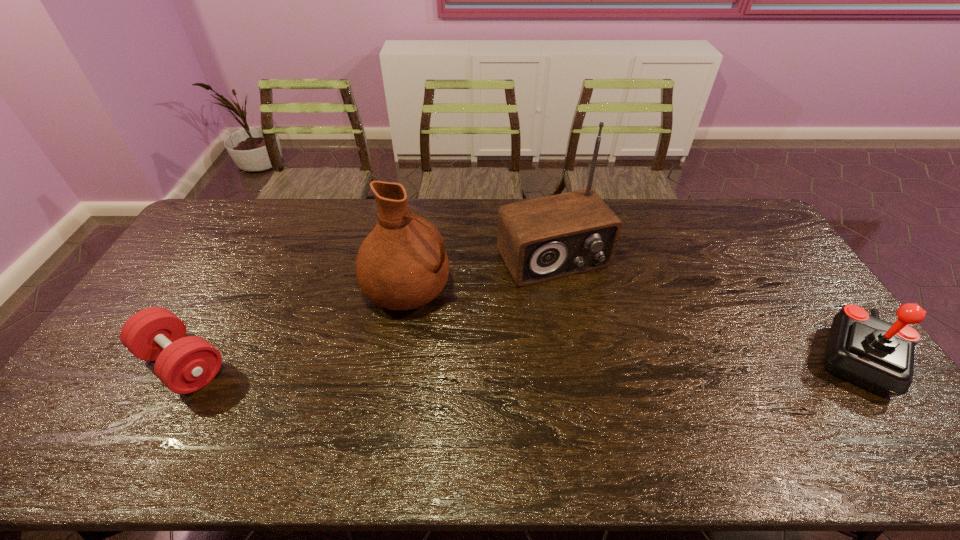
Where is `the leftmost object`? the leftmost object is located at coordinates (184, 364).

At what (x,y) coordinates should I click in order to perform the action: click on dumbbell. Please return your answer as a coordinate pair (x, y). Image resolution: width=960 pixels, height=540 pixels. Looking at the image, I should click on (184, 364).

The image size is (960, 540). I want to click on the third tallest object, so click(x=877, y=355).

Locate an element on the screen. This screenshot has width=960, height=540. the rightmost object is located at coordinates (877, 355).

Find the location of a particular element. The width and height of the screenshot is (960, 540). pitcher is located at coordinates (401, 265).

In order to click on the third shortest object in this screenshot , I will do `click(401, 265)`.

Locate an element on the screen. The width and height of the screenshot is (960, 540). the third object from left to right is located at coordinates (542, 239).

The height and width of the screenshot is (540, 960). Identify the location of vacant space situated 0.390m on the back of the shortest object. (252, 242).

The height and width of the screenshot is (540, 960). Identify the location of vacant space situated 0.320m on the left of the joystick. (695, 358).

Locate an element on the screen. This screenshot has height=540, width=960. free region located 0.280m on the side of the third shortest object with the handle is located at coordinates (525, 344).